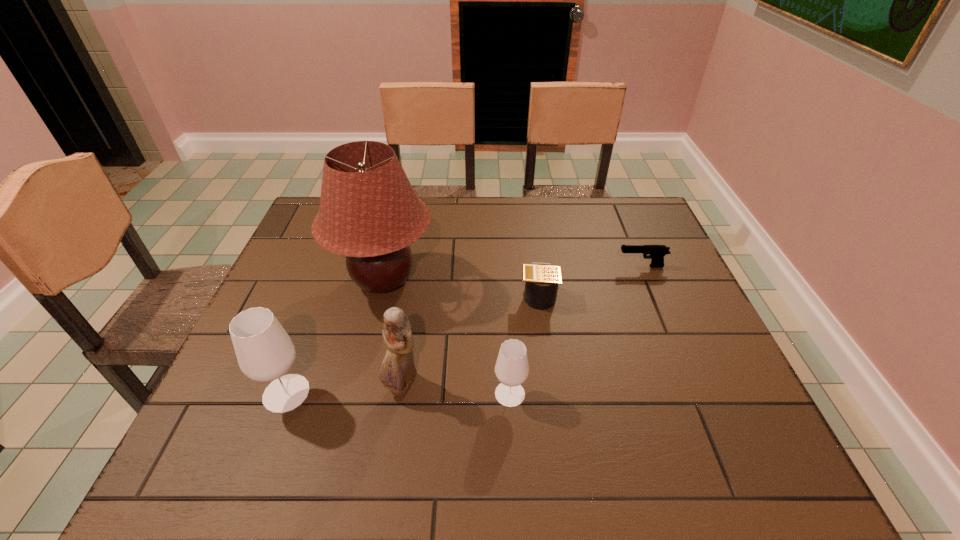
In the current image, all glasss are evenly spaced. To maintain this equal spacing, where should an additional glass be placed on the right? Please point out a free spot. Please provide its 2D coordinates. Your answer should be formatted as a tuple, i.e. [(x, y)], where the tuple contains the x and y coordinates of a point satisfying the conditions above.

[(734, 395)]